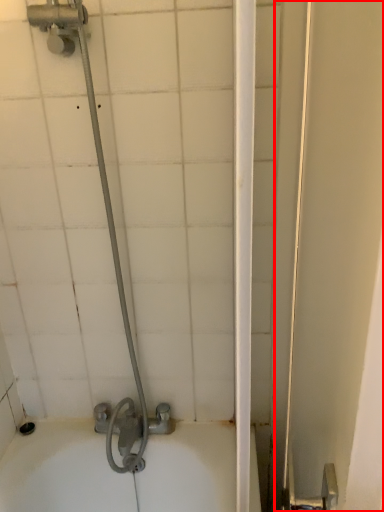
Question: From the image's perspective, considering the relative positions of screen door (annotated by the red box) and shower in the image provided, where is screen door (annotated by the red box) located with respect to the staircase?

Choices:
 (A) below
 (B) above

Answer: (A)